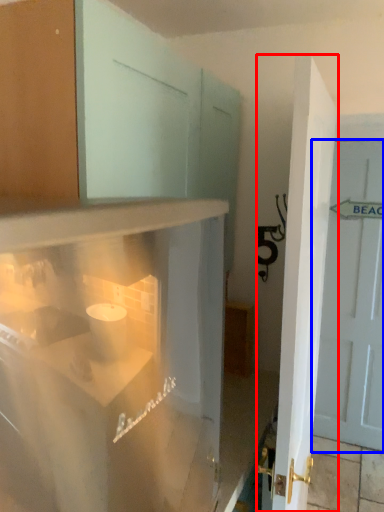
Question: Among these objects, which one is nearest to the camera, door (highlighted by a red box) or door (highlighted by a blue box)?

Choices:
 (A) door
 (B) door

Answer: (A)